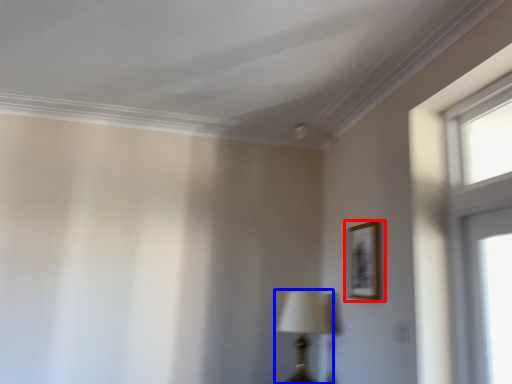
Question: Which object is further to the camera taking this photo, picture frame (highlighted by a red box) or table lamp (highlighted by a blue box)?

Choices:
 (A) picture frame
 (B) table lamp

Answer: (B)